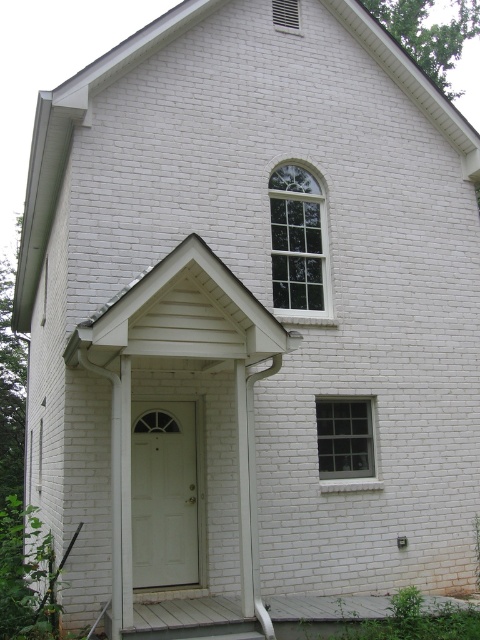
You are standing in front of the house and want to know if the point at coordinate point (160, 525) is closer to you than the point at coordinate point (324, 620). Can you determine this based on the house structure?

Yes, the point at coordinate point (160, 525) is closer to you than the point at coordinate point (324, 620) because it is further to the camera according to the description.

You are standing in front of the house and want to step onto the white wooden porch at lower center. Is the white glossy door at center blocking your path to the porch?

The white wooden porch at lower center is behind the white glossy door at center, so the door is blocking the path to the porch. You need to open the door to access the porch.